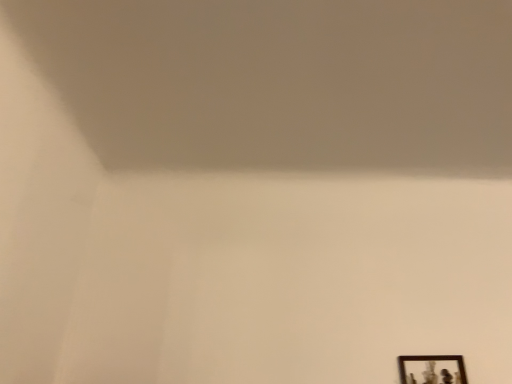
Question: Does wooden framed picture at lower right have a lesser width compared to white matte wall at upper center?

Choices:
 (A) yes
 (B) no

Answer: (A)

Question: Is the position of wooden framed picture at lower right less distant than that of white matte wall at upper center?

Choices:
 (A) no
 (B) yes

Answer: (A)

Question: Are wooden framed picture at lower right and white matte wall at upper center far apart?

Choices:
 (A) yes
 (B) no

Answer: (B)

Question: Is wooden framed picture at lower right at the left side of white matte wall at upper center?

Choices:
 (A) yes
 (B) no

Answer: (B)

Question: Can you confirm if wooden framed picture at lower right is wider than white matte wall at upper center?

Choices:
 (A) no
 (B) yes

Answer: (A)

Question: Could you tell me if wooden framed picture at lower right is facing white matte wall at upper center?

Choices:
 (A) yes
 (B) no

Answer: (B)

Question: Does white matte wall at upper center touch wooden framed picture at lower right?

Choices:
 (A) yes
 (B) no

Answer: (B)

Question: Is wooden framed picture at lower right at the back of white matte wall at upper center?

Choices:
 (A) yes
 (B) no

Answer: (B)

Question: Is white matte wall at upper center behind wooden framed picture at lower right?

Choices:
 (A) no
 (B) yes

Answer: (A)

Question: Does white matte wall at upper center have a smaller size compared to wooden framed picture at lower right?

Choices:
 (A) yes
 (B) no

Answer: (B)

Question: From the image's perspective, is white matte wall at upper center on top of wooden framed picture at lower right?

Choices:
 (A) no
 (B) yes

Answer: (B)

Question: Considering the relative sizes of white matte wall at upper center and wooden framed picture at lower right in the image provided, is white matte wall at upper center wider than wooden framed picture at lower right?

Choices:
 (A) yes
 (B) no

Answer: (A)

Question: Looking at the image, does white matte wall at upper center seem bigger or smaller compared to wooden framed picture at lower right?

Choices:
 (A) big
 (B) small

Answer: (A)